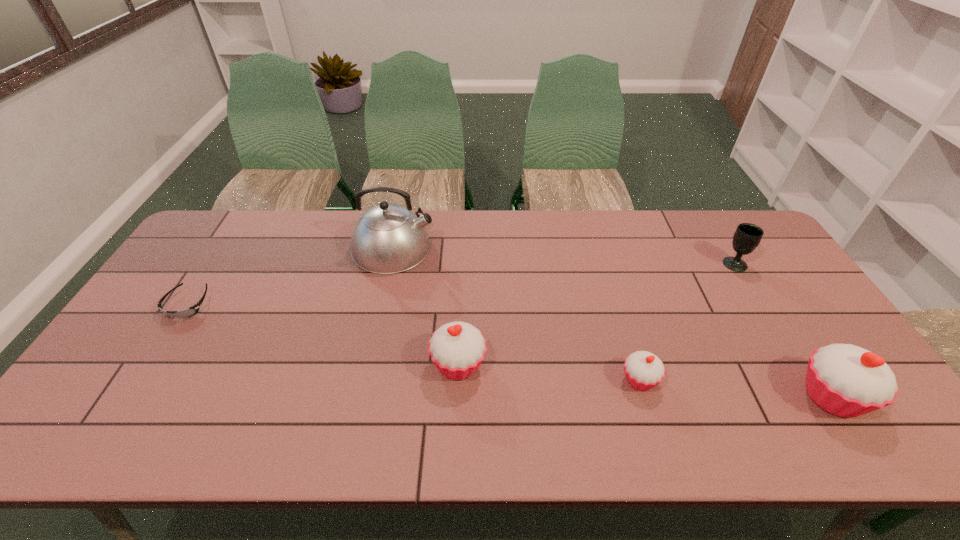
This screenshot has width=960, height=540. Find the location of `object present at the near right corner`. object present at the near right corner is located at coordinates (846, 380).

Locate an element on the screen. vacant space at the far edge of the desktop is located at coordinates (705, 237).

This screenshot has width=960, height=540. In order to click on free space at the near edge of the desktop in this screenshot , I will do `click(776, 380)`.

This screenshot has width=960, height=540. Identify the location of vacant space at the left edge of the desktop. (187, 257).

You are a GUI agent. You are given a task and a screenshot of the screen. Output one action in this format:
    pyautogui.click(x=<x>, y=<y>)
    Task: Click on the vacant space at the right edge of the desktop
    
    Given the screenshot: What is the action you would take?
    pyautogui.click(x=747, y=258)

Locate an element on the screen. free spot at the far left corner of the desktop is located at coordinates (250, 221).

You are a GUI agent. You are given a task and a screenshot of the screen. Output one action in this format:
    pyautogui.click(x=<x>, y=<y>)
    Task: Click on the vacant space at the near left corner of the desktop
    Image resolution: width=960 pixels, height=540 pixels.
    Given the screenshot: What is the action you would take?
    pyautogui.click(x=116, y=378)

Identify the location of free space that is in between the second object from left to right and the fourth nearest object. This screenshot has height=540, width=960. (291, 276).

This screenshot has width=960, height=540. I want to click on unoccupied position between the second shortest cupcake and the second cupcake from left to right, so click(x=549, y=373).

At what (x,y) coordinates should I click in order to perform the action: click on free space between the kettle and the chalice. Please return your answer as a coordinate pair (x, y). Looking at the image, I should click on (564, 255).